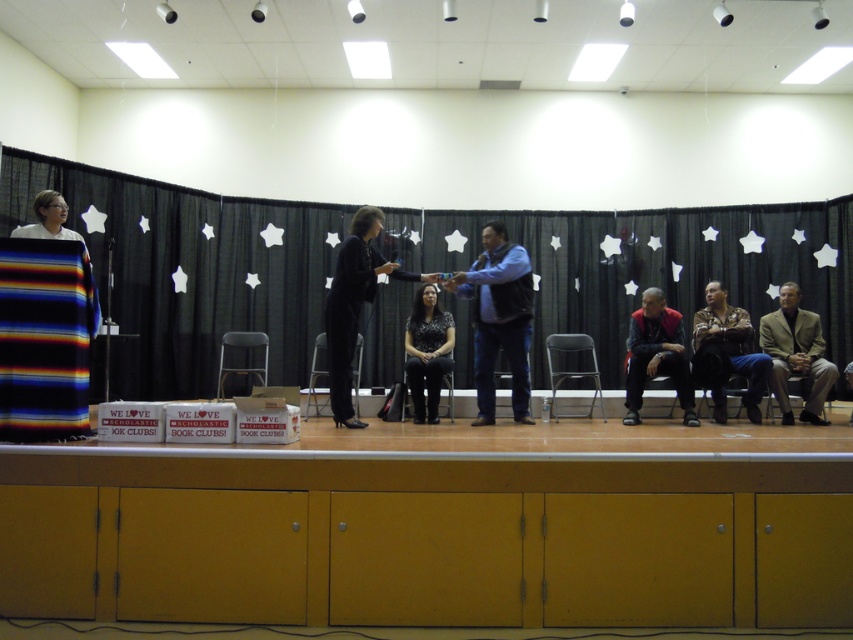
Between black satin dress at center and dark brown leather chair at lower right, which one is positioned higher?

black satin dress at center is higher up.

Measure the distance between black satin dress at center and camera.

A distance of 17.84 feet exists between black satin dress at center and camera.

Identify the location of black satin dress at center. (427, 352).

Between point (352, 264) and point (527, 404), which one is positioned behind?

The point (527, 404) is behind.

Is black matte dress at center wider than metallic silver chair at center?

Indeed, black matte dress at center has a greater width compared to metallic silver chair at center.

Find the location of a particular element. black matte dress at center is located at coordinates (354, 304).

Who is higher up, black matte dress at center or black satin dress at center?

black matte dress at center is above.

Who is more forward, (341, 321) or (416, 317)?

Positioned in front is point (341, 321).

Looking at this image, who is more forward, (344, 248) or (430, 381)?

Positioned in front is point (344, 248).

You are a GUI agent. You are given a task and a screenshot of the screen. Output one action in this format:
    pyautogui.click(x=<x>, y=<y>)
    Task: Click on the black matte dress at center
    This screenshot has width=853, height=640.
    Given the screenshot: What is the action you would take?
    pyautogui.click(x=354, y=304)